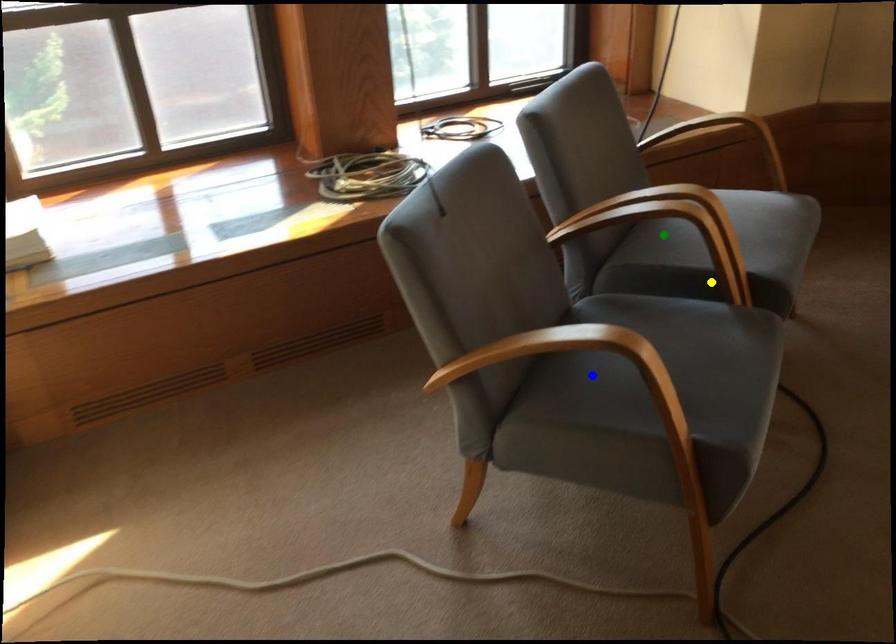
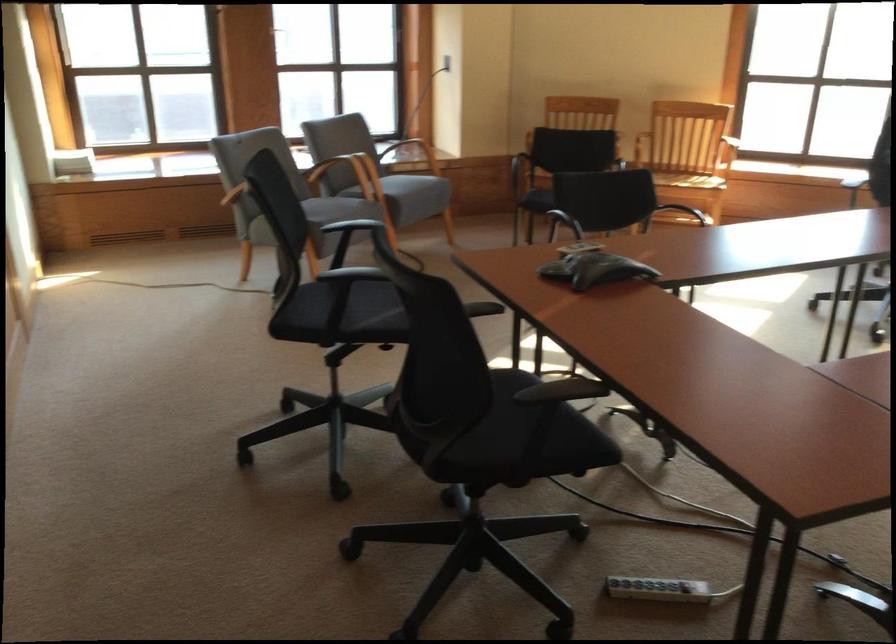
I am providing you with two images of the same scene from different viewpoints. Three points are marked in image1. Which point corresponds to a part or object that is occluded in image2?In image1, three points are marked. Which of them correspond to a part or object that is occluded in image2?Among the three points shown in image1, which one corresponds to a part or object that is no longer visible due to occlusion in image2?

blue point, green point